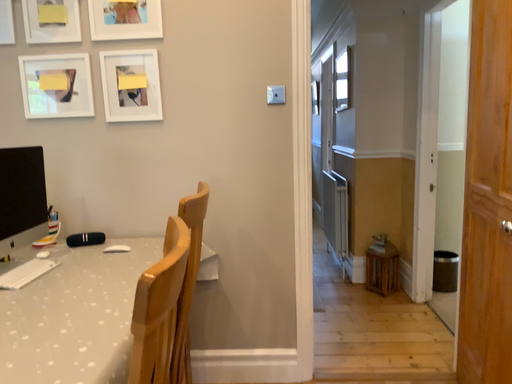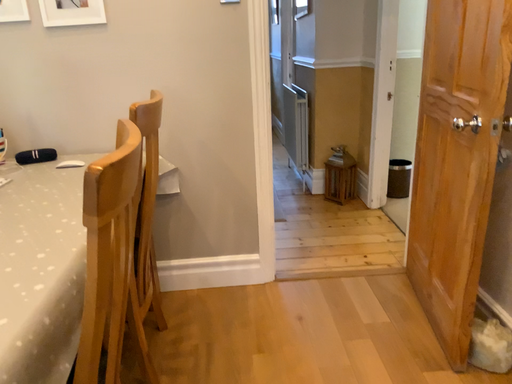
Question: Which way did the camera rotate in the video?

Choices:
 (A) rotated downward
 (B) rotated upward

Answer: (A)